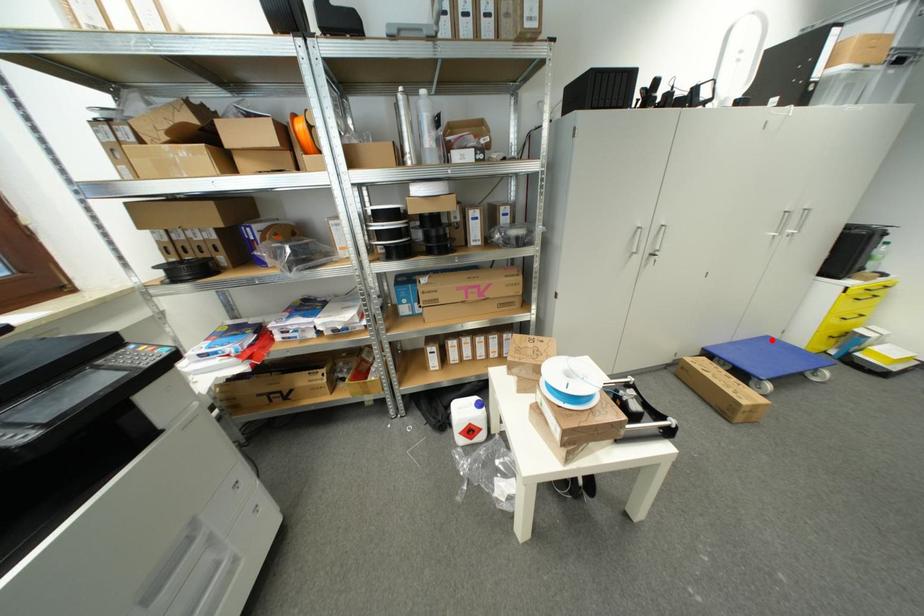
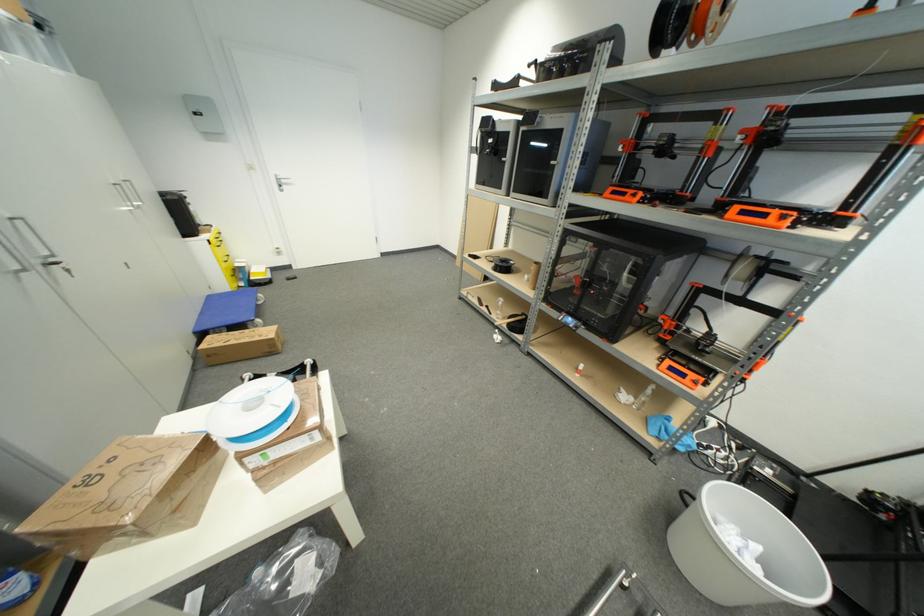
Question: I am providing you with two images of the same scene from different viewpoints. Image1 has a red point marked. In image2, the corresponding 3D location appears at what relative position? Reply with the corresponding letter.

Choices:
 (A) Closer
 (B) Farther

Answer: (A)